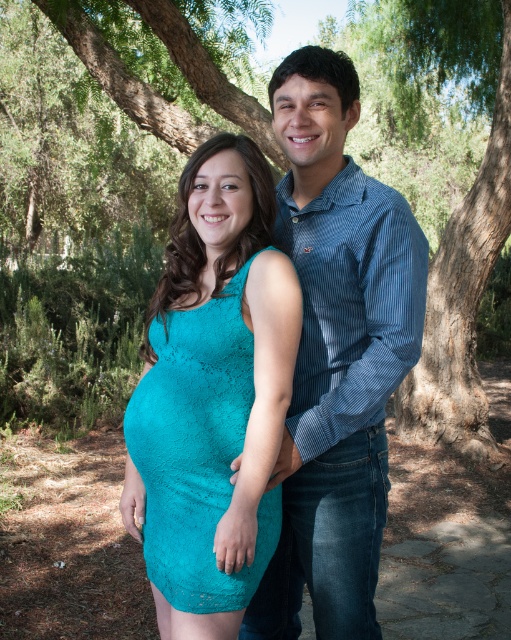
Question: Which point is farther to the camera?

Choices:
 (A) blue striped shirt at center
 (B) green leafy tree at center
 (C) teal lace dress at center

Answer: (B)

Question: Which of these objects is positioned farthest from the teal lace dress at center?

Choices:
 (A) green leafy tree at center
 (B) blue striped shirt at center

Answer: (A)

Question: Does blue striped shirt at center have a larger size compared to teal lace dress at center?

Choices:
 (A) no
 (B) yes

Answer: (B)

Question: Observing the image, what is the correct spatial positioning of blue striped shirt at center in reference to green leafy tree at center?

Choices:
 (A) left
 (B) right

Answer: (B)

Question: Can you confirm if green leafy tree at center is positioned below teal lace dress at center?

Choices:
 (A) no
 (B) yes

Answer: (A)

Question: Estimate the real-world distances between objects in this image. Which object is closer to the blue striped shirt at center?

Choices:
 (A) teal lace dress at center
 (B) green leafy tree at center

Answer: (A)